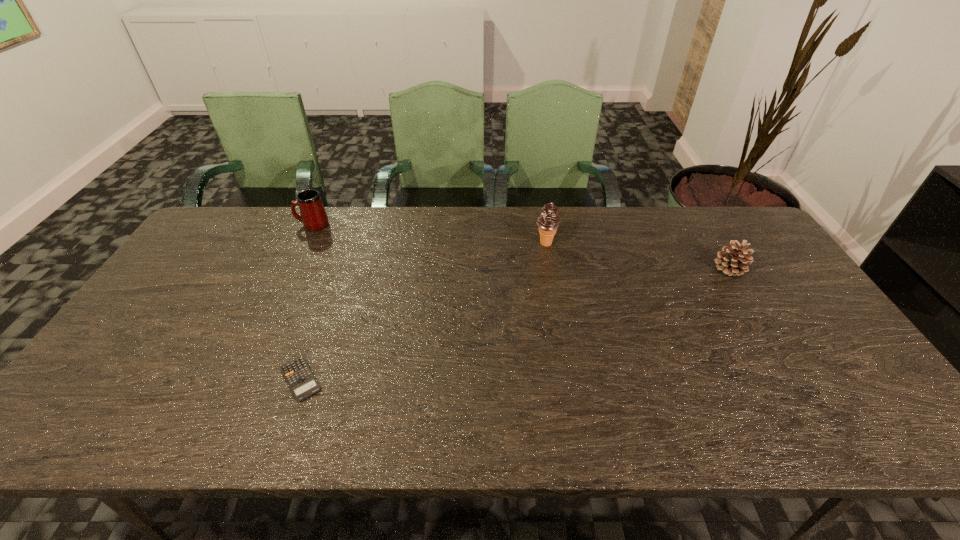
The image size is (960, 540). Find the location of `vacant space in between the third nearest object and the second nearest object`. vacant space in between the third nearest object and the second nearest object is located at coordinates (637, 256).

Point out which object is positioned as the nearest to the calculator. Please provide its 2D coordinates. Your answer should be formatted as a tuple, i.e. [(x, y)], where the tuple contains the x and y coordinates of a point satisfying the conditions above.

[(313, 216)]

This screenshot has height=540, width=960. What are the coordinates of `the closest object to the rightmost object` in the screenshot? It's located at (548, 221).

Where is `blank space that satisfies the following two spatial constraints: 1. on the side of the second object from right to left with the handle; 2. on the left side of the farthest object`? This screenshot has height=540, width=960. blank space that satisfies the following two spatial constraints: 1. on the side of the second object from right to left with the handle; 2. on the left side of the farthest object is located at coordinates (304, 244).

Find the location of a particular element. This screenshot has height=540, width=960. free space that satisfies the following two spatial constraints: 1. on the side of the rightmost object with the handle; 2. on the left side of the leftmost object is located at coordinates (293, 268).

The width and height of the screenshot is (960, 540). I want to click on vacant region that satisfies the following two spatial constraints: 1. on the back side of the third nearest object; 2. on the left side of the nearest object, so click(348, 244).

What are the coordinates of `free location that satisfies the following two spatial constraints: 1. on the side of the farthest object with the handle; 2. on the back side of the pinecone` in the screenshot? It's located at (293, 268).

The height and width of the screenshot is (540, 960). I want to click on vacant space that satisfies the following two spatial constraints: 1. on the back side of the shortest object; 2. on the left side of the tallest object, so click(348, 244).

Find the location of a particular element. free spot that satisfies the following two spatial constraints: 1. on the back side of the calculator; 2. on the left side of the second farthest object is located at coordinates (348, 244).